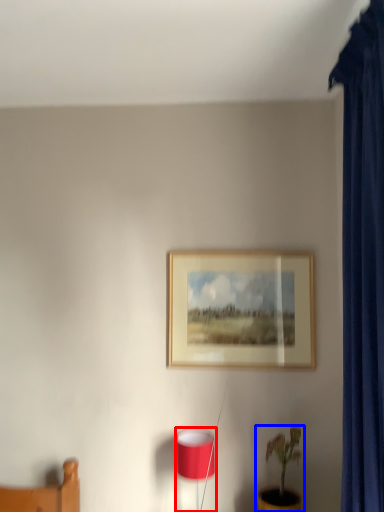
Question: Which object appears closest to the camera in this image, table lamp (highlighted by a red box) or houseplant (highlighted by a blue box)?

Choices:
 (A) table lamp
 (B) houseplant

Answer: (B)